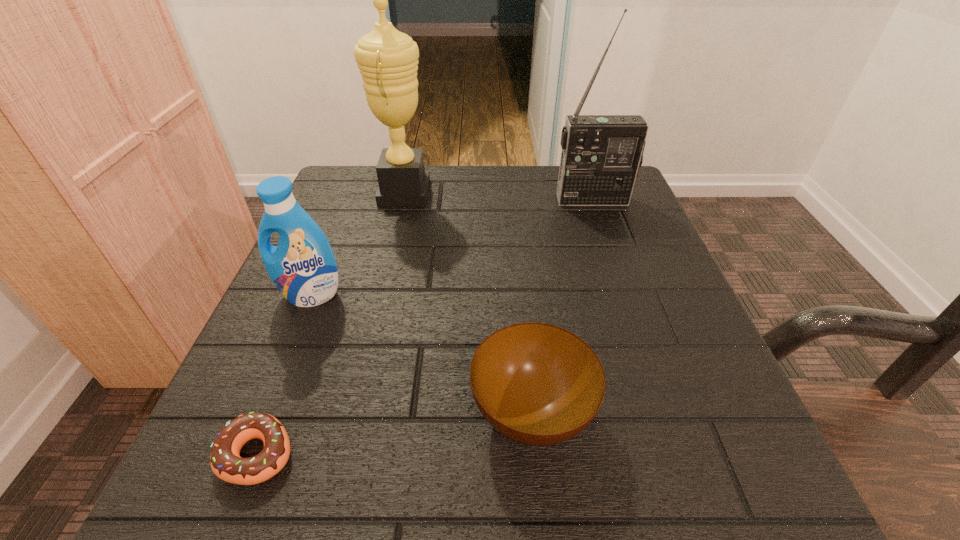
Where is `trophy cup`? This screenshot has height=540, width=960. trophy cup is located at coordinates (387, 59).

Find the location of a particular element. The height and width of the screenshot is (540, 960). the rightmost object is located at coordinates (601, 154).

Image resolution: width=960 pixels, height=540 pixels. In order to click on the third nearest object in this screenshot , I will do `click(302, 266)`.

You are a GUI agent. You are given a task and a screenshot of the screen. Output one action in this format:
    pyautogui.click(x=<x>, y=<y>)
    Task: Click on the third shortest object
    This screenshot has width=960, height=540.
    Given the screenshot: What is the action you would take?
    pyautogui.click(x=302, y=266)

Locate an element on the screen. bowl is located at coordinates (537, 384).

At what (x,y) coordinates should I click in order to perform the action: click on the fourth tallest object. Please return your answer as a coordinate pair (x, y). The image size is (960, 540). Looking at the image, I should click on (537, 384).

This screenshot has width=960, height=540. I want to click on the shortest object, so click(226, 463).

What are the coordinates of `vacant space located 0.190m at the front of the trophy cup with handles` in the screenshot? It's located at (513, 192).

Locate an element on the screen. The width and height of the screenshot is (960, 540). vacant space located 0.340m on the display of the rightmost object is located at coordinates (635, 320).

Find the location of a particular element. free region located on the front-facing side of the third shortest object is located at coordinates (230, 495).